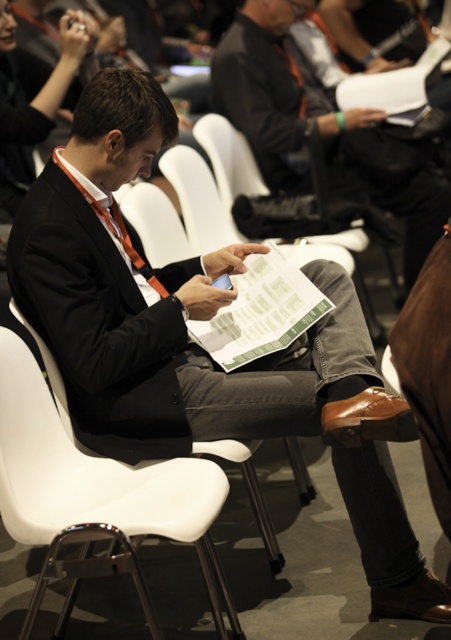
Question: Which of the following is the farthest from the observer?

Choices:
 (A) (377, 109)
 (B) (124, 554)

Answer: (A)

Question: From the image, what is the correct spatial relationship of white plastic chair at center in relation to matte black suit at center?

Choices:
 (A) left
 (B) right

Answer: (A)

Question: Is white plastic chair at center to the left of matte black suit at center from the viewer's perspective?

Choices:
 (A) yes
 (B) no

Answer: (A)

Question: Is white plastic chair at center thinner than matte black suit at center?

Choices:
 (A) yes
 (B) no

Answer: (A)